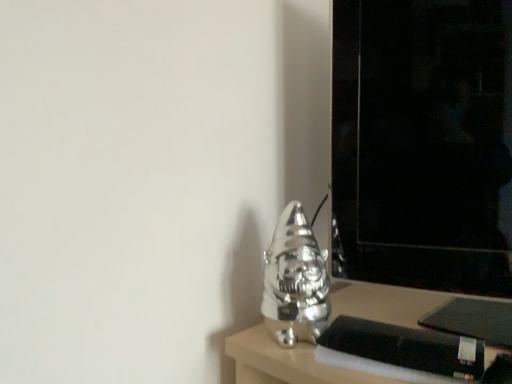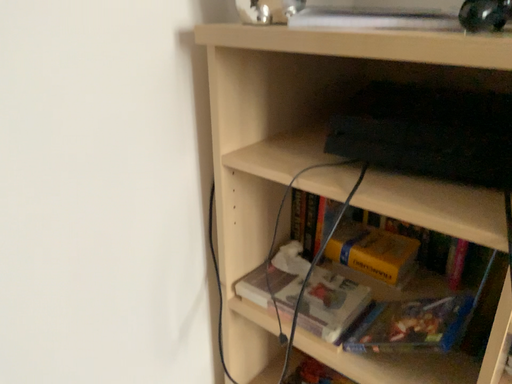
Question: Which way did the camera rotate in the video?

Choices:
 (A) rotated downward
 (B) rotated upward

Answer: (A)